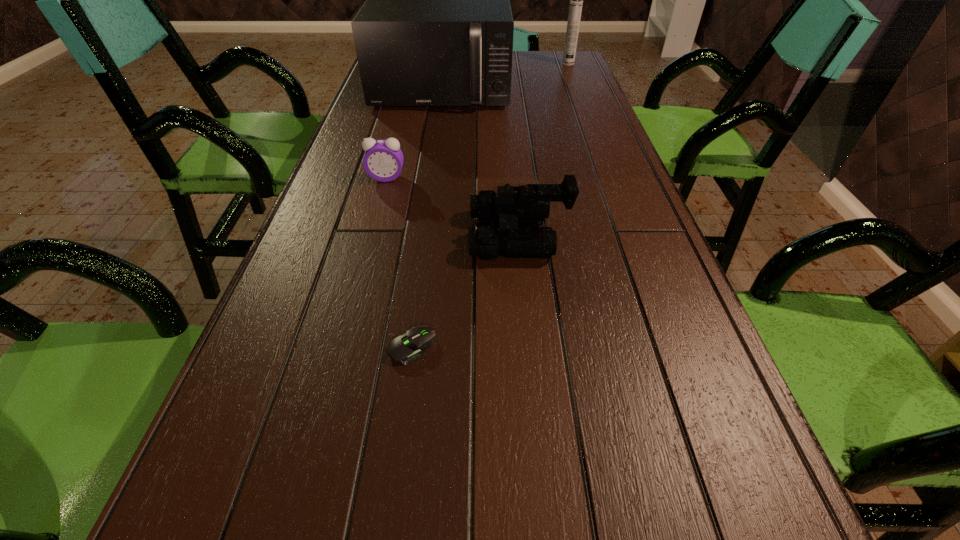
Identify the location of vacant position located 0.360m on the front lenses of the binoculars. The image size is (960, 540). (301, 235).

The height and width of the screenshot is (540, 960). In order to click on free space located on the front lenses of the binoculars in this screenshot , I will do `click(348, 235)`.

Locate an element on the screen. free spot located 0.070m on the front lenses of the binoculars is located at coordinates (438, 235).

Image resolution: width=960 pixels, height=540 pixels. Identify the location of vacant space situated on the face of the fourth tallest object. (371, 238).

The width and height of the screenshot is (960, 540). I want to click on vacant region located on the front of the nearest object, so click(401, 431).

Where is `aerosol can that is at the far edge`? The image size is (960, 540). aerosol can that is at the far edge is located at coordinates (576, 0).

You are a GUI agent. You are given a task and a screenshot of the screen. Output one action in this format:
    pyautogui.click(x=<x>, y=<y>)
    Task: Click on the microwave oven present at the far edge
    The image size is (960, 540).
    Given the screenshot: What is the action you would take?
    pyautogui.click(x=436, y=29)

Locate an element on the screen. microwave oven that is positioned at the left edge is located at coordinates (436, 29).

Locate an element on the screen. The height and width of the screenshot is (540, 960). alarm clock present at the left edge is located at coordinates 383,160.

Find the location of a particular element. object that is at the right edge is located at coordinates (576, 0).